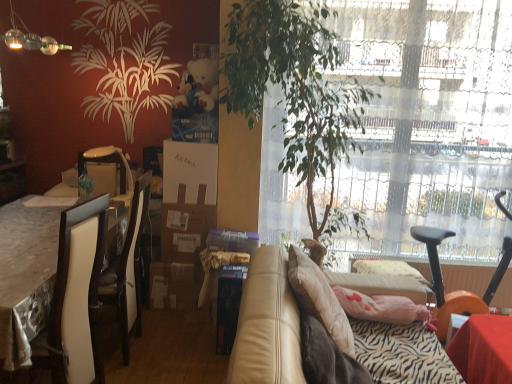
Question: From a real-world perspective, is leather couch at center positioned under matte white armchair at left based on gravity?

Choices:
 (A) yes
 (B) no

Answer: (A)

Question: Is leather couch at center not close to matte white armchair at left?

Choices:
 (A) no
 (B) yes

Answer: (B)

Question: Could you tell me if leather couch at center is turned towards matte white armchair at left?

Choices:
 (A) no
 (B) yes

Answer: (A)

Question: Is leather couch at center oriented away from matte white armchair at left?

Choices:
 (A) no
 (B) yes

Answer: (B)

Question: Considering the relative sizes of leather couch at center and matte white armchair at left in the image provided, is leather couch at center smaller than matte white armchair at left?

Choices:
 (A) no
 (B) yes

Answer: (A)

Question: Is point (284, 69) closer or farther from the camera than point (414, 375)?

Choices:
 (A) farther
 (B) closer

Answer: (A)

Question: Relative to leather couch at center, is green leafy plant at center in front or behind?

Choices:
 (A) behind
 (B) front

Answer: (A)

Question: In terms of height, does green leafy plant at center look taller or shorter compared to leather couch at center?

Choices:
 (A) short
 (B) tall

Answer: (B)

Question: Choose the correct answer: Is green leafy plant at center inside leather couch at center or outside it?

Choices:
 (A) outside
 (B) inside

Answer: (A)

Question: From a real-world perspective, is green plastic bottle at center positioned above or below matte white armchair at left?

Choices:
 (A) above
 (B) below

Answer: (B)

Question: From the image's perspective, is green plastic bottle at center located above or below matte white armchair at left?

Choices:
 (A) above
 (B) below

Answer: (B)

Question: In the image, is green plastic bottle at center on the left side or the right side of matte white armchair at left?

Choices:
 (A) left
 (B) right

Answer: (A)

Question: Looking at the image, does green plastic bottle at center seem bigger or smaller compared to matte white armchair at left?

Choices:
 (A) big
 (B) small

Answer: (B)

Question: Would you say white cardboard box at center, which ranks as the 1th box in back-to-front order, is to the left or to the right of white glossy table at left in the picture?

Choices:
 (A) right
 (B) left

Answer: (A)

Question: In the image, is white cardboard box at center, the 1th box in the top-to-bottom sequence, positioned in front of or behind white glossy table at left?

Choices:
 (A) front
 (B) behind

Answer: (B)